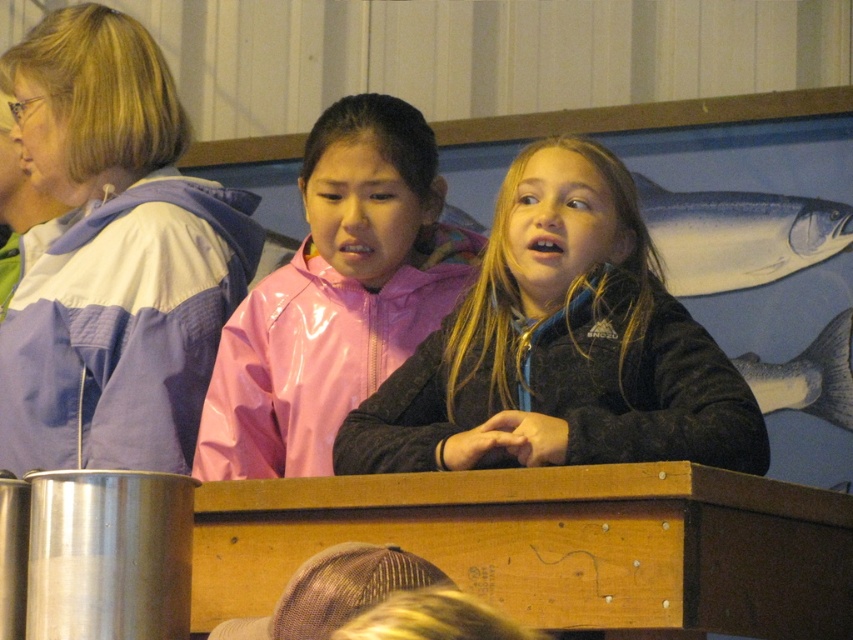
Question: Which object appears closest to the camera in this image?

Choices:
 (A) matte black jacket at center
 (B) blue glossy fish at upper right
 (C) pink glossy jacket at center

Answer: (A)

Question: From the image, what is the correct spatial relationship of pink glossy jacket at center in relation to blue glossy fish at upper right?

Choices:
 (A) above
 (B) below

Answer: (B)

Question: Does matte black jacket at center lie in front of blue glossy fish at upper right?

Choices:
 (A) no
 (B) yes

Answer: (B)

Question: Does matte black jacket at center have a larger size compared to blue glossy fish at upper right?

Choices:
 (A) no
 (B) yes

Answer: (B)

Question: Which object appears closest to the camera in this image?

Choices:
 (A) matte black jacket at center
 (B) shiny silver fish at upper right

Answer: (A)

Question: Estimate the real-world distances between objects in this image. Which object is farther from the pink glossy jacket at center?

Choices:
 (A) shiny silver fish at upper right
 (B) matte black jacket at center

Answer: (A)